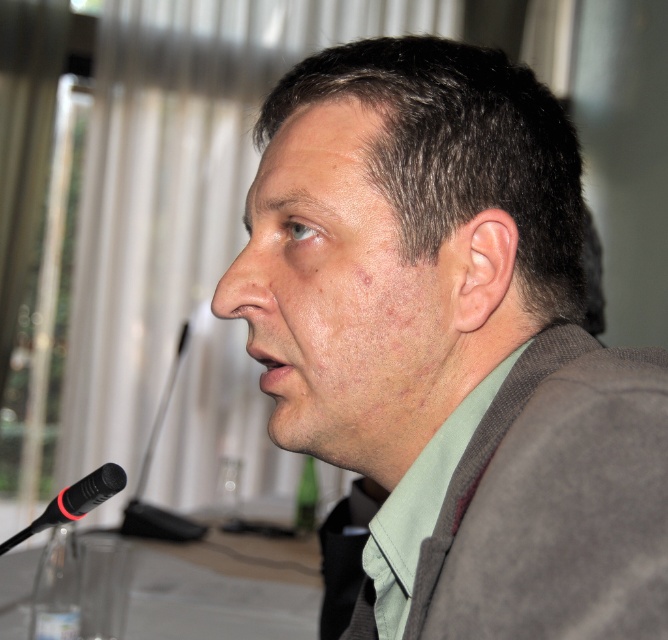
Does black rubberized microphone at lower left have a larger size compared to green glass bottle at lower center?

No.

Looking at this image, can you confirm if black rubberized microphone at lower left is positioned below green glass bottle at lower center?

No.

Does point (55, 515) lie behind point (305, 458)?

That is False.

Where is `black rubberized microphone at lower left`? The width and height of the screenshot is (668, 640). black rubberized microphone at lower left is located at coordinates (73, 500).

Is transparent glass bottle at lower left taller than green glass bottle at lower center?

No.

Between transparent glass bottle at lower left and green glass bottle at lower center, which one appears on the left side from the viewer's perspective?

transparent glass bottle at lower left is more to the left.

Between point (39, 598) and point (301, 468), which one is positioned in front?

Point (39, 598) is in front.

Image resolution: width=668 pixels, height=640 pixels. Identify the location of transparent glass bottle at lower left. (55, 588).

Is transparent glass bottle at lower left to the left of black rubberized microphone at lower left from the viewer's perspective?

Yes, transparent glass bottle at lower left is to the left of black rubberized microphone at lower left.

Who is lower down, transparent glass bottle at lower left or black rubberized microphone at lower left?

transparent glass bottle at lower left

Is point (33, 614) positioned in front of point (94, 477)?

That is False.

The image size is (668, 640). I want to click on transparent glass bottle at lower left, so click(x=55, y=588).